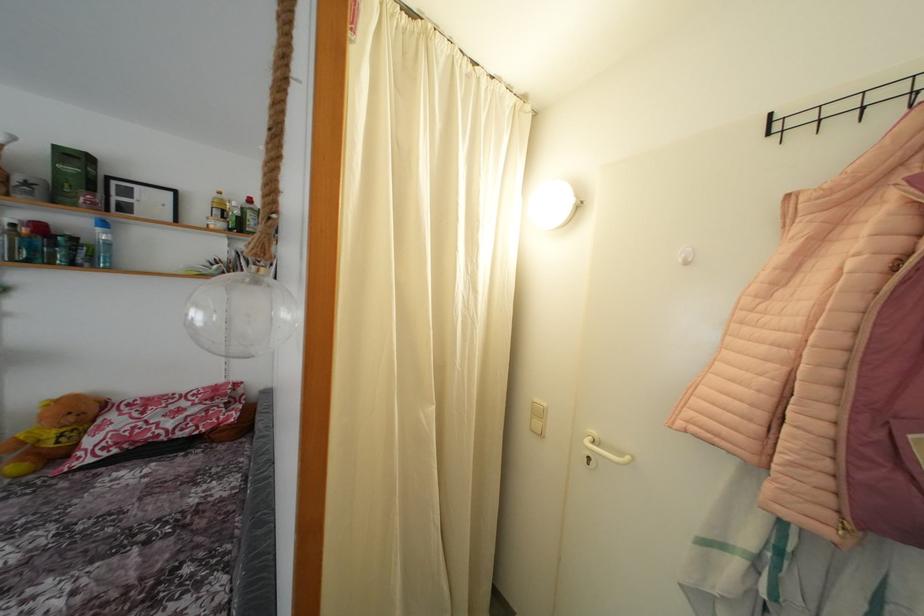
Locate an element on the screen. The width and height of the screenshot is (924, 616). green cardboard box is located at coordinates (71, 175).